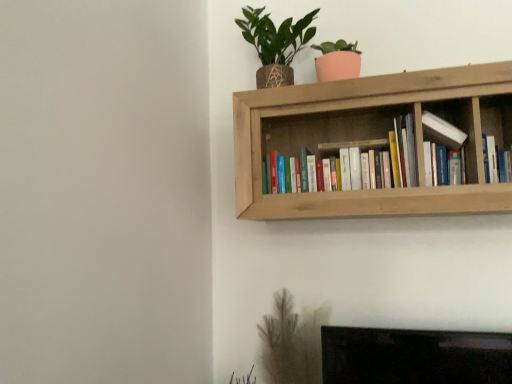
Describe the element at coordinates (496, 161) in the screenshot. I see `hardcover book at upper right, which is counted as the 1th book, starting from the right` at that location.

What is the approximate width of hardcover books at center, arranged as the second book when viewed from the right?

6.81 inches.

What do you see at coordinates (345, 138) in the screenshot? I see `hardcover books at center, the 1th book viewed from the left` at bounding box center [345, 138].

Identify the location of white glossy bookshelf at upper right. (452, 130).

Considering the positions of point (271, 83) and point (348, 176), is point (271, 83) closer or farther from the camera than point (348, 176)?

Point (271, 83) is closer to the camera than point (348, 176).

Can you confirm if green leafy plant in woven pot at upper right is bigger than hardcover books at center, arranged as the second book when viewed from the right?

Correct, green leafy plant in woven pot at upper right is larger in size than hardcover books at center, arranged as the second book when viewed from the right.

Is green leafy plant in woven pot at upper right positioned with its back to hardcover books at center, arranged as the second book when viewed from the right?

No, green leafy plant in woven pot at upper right is not facing the opposite direction of hardcover books at center, arranged as the second book when viewed from the right.

Find the location of a particular element. This screenshot has width=512, height=384. book that is the 1st one when counting downward from the natural wood bookshelf at upper center (from the image's perspective) is located at coordinates (345, 138).

From the image's perspective, between hardcover books at center, the 1th book viewed from the left, and natural wood bookshelf at upper center, who is located below?

hardcover books at center, the 1th book viewed from the left.

Is hardcover books at center, arranged as the second book when viewed from the right, at the left side of natural wood bookshelf at upper center?

Indeed, hardcover books at center, arranged as the second book when viewed from the right, is positioned on the left side of natural wood bookshelf at upper center.

Which of these two, hardcover book at upper right, positioned as the 2th book in left-to-right order, or white glossy bookshelf at upper right, stands taller?

white glossy bookshelf at upper right is taller.

Would you say white glossy bookshelf at upper right is part of hardcover book at upper right, which is counted as the 1th book, starting from the right,'s contents?

No.

Could you tell me if hardcover book at upper right, which is counted as the 1th book, starting from the right, is facing white glossy bookshelf at upper right?

No, hardcover book at upper right, which is counted as the 1th book, starting from the right, is not facing towards white glossy bookshelf at upper right.

Looking at this image, is the surface of hardcover book at upper right, positioned as the 2th book in left-to-right order, in direct contact with white glossy bookshelf at upper right?

hardcover book at upper right, positioned as the 2th book in left-to-right order, and white glossy bookshelf at upper right are clearly separated.

Is hardcover books at center, the 1th book viewed from the left, bigger than white glossy bookshelf at upper right?

Indeed, hardcover books at center, the 1th book viewed from the left, has a larger size compared to white glossy bookshelf at upper right.

Is hardcover books at center, the 1th book viewed from the left, turned away from white glossy bookshelf at upper right?

hardcover books at center, the 1th book viewed from the left, does not have its back to white glossy bookshelf at upper right.

From a real-world perspective, is hardcover books at center, arranged as the second book when viewed from the right, beneath white glossy bookshelf at upper right?

Yes, from a real-world perspective, hardcover books at center, arranged as the second book when viewed from the right, is below white glossy bookshelf at upper right.

Are hardcover books at center, arranged as the second book when viewed from the right, and white glossy bookshelf at upper right making contact?

hardcover books at center, arranged as the second book when viewed from the right, and white glossy bookshelf at upper right are clearly separated.

Does white glossy bookshelf at upper right touch hardcover books at center, the 1th book viewed from the left?

No, white glossy bookshelf at upper right is not making contact with hardcover books at center, the 1th book viewed from the left.

Could you tell me if white glossy bookshelf at upper right is facing hardcover books at center, arranged as the second book when viewed from the right?

No, white glossy bookshelf at upper right is not aimed at hardcover books at center, arranged as the second book when viewed from the right.

Locate an element on the screen. The width and height of the screenshot is (512, 384). cabinet above the hardcover books at center, arranged as the second book when viewed from the right (from a real-world perspective) is located at coordinates (452, 130).

Considering the relative sizes of white glossy bookshelf at upper right and hardcover books at center, arranged as the second book when viewed from the right, in the image provided, is white glossy bookshelf at upper right wider than hardcover books at center, arranged as the second book when viewed from the right,?

No.

Is hardcover books at center, the 1th book viewed from the left, positioned with its back to hardcover book at upper right, positioned as the 2th book in left-to-right order?

hardcover books at center, the 1th book viewed from the left, is not turned away from hardcover book at upper right, positioned as the 2th book in left-to-right order.

How many degrees apart are the facing directions of hardcover books at center, arranged as the second book when viewed from the right, and hardcover book at upper right, which is counted as the 1th book, starting from the right?

0.00383 degrees.

Is hardcover books at center, the 1th book viewed from the left, directly adjacent to hardcover book at upper right, positioned as the 2th book in left-to-right order?

No, hardcover books at center, the 1th book viewed from the left, is not in contact with hardcover book at upper right, positioned as the 2th book in left-to-right order.

In the scene shown: Looking at the image, does hardcover books at center, arranged as the second book when viewed from the right, seem bigger or smaller compared to hardcover book at upper right, which is counted as the 1th book, starting from the right?

Considering their sizes, hardcover books at center, arranged as the second book when viewed from the right, takes up more space than hardcover book at upper right, which is counted as the 1th book, starting from the right.

Between green leafy plant in woven pot at upper right and white glossy bookshelf at upper right, which one has more height?

With more height is green leafy plant in woven pot at upper right.

Which is closer to the camera, [238,22] or [433,117]?

The point [433,117] is closer.

Can white glossy bookshelf at upper right be found inside green leafy plant in woven pot at upper right?

Actually, white glossy bookshelf at upper right is outside green leafy plant in woven pot at upper right.

Is green leafy plant in woven pot at upper right further to camera compared to white glossy bookshelf at upper right?

Yes, the depth of green leafy plant in woven pot at upper right is greater than that of white glossy bookshelf at upper right.

At what (x,y) coordinates should I click in order to perform the action: click on houseplant behind the hardcover books at center, the 1th book viewed from the left. Please return your answer as a coordinate pair (x, y). Looking at the image, I should click on (275, 44).

Locate an element on the screen. This screenshot has height=384, width=512. shelf above the hardcover books at center, arranged as the second book when viewed from the right (from the image's perspective) is located at coordinates (372, 138).

From the picture: Estimate the real-world distances between objects in this image. Which object is closer to hardcover book at upper right, which is counted as the 1th book, starting from the right, white glossy bookshelf at upper right or natural wood bookshelf at upper center?

white glossy bookshelf at upper right.

When comparing their distances from natural wood bookshelf at upper center, does green leafy plant in woven pot at upper right or white glossy bookshelf at upper right seem further?

green leafy plant in woven pot at upper right is positioned further to the anchor natural wood bookshelf at upper center.

Which object lies nearer to the anchor point green leafy plant in woven pot at upper right, white glossy bookshelf at upper right or hardcover book at upper right, which is counted as the 1th book, starting from the right?

The object closer to green leafy plant in woven pot at upper right is white glossy bookshelf at upper right.

Estimate the real-world distances between objects in this image. Which object is further from natural wood bookshelf at upper center, white glossy bookshelf at upper right or green leafy plant in woven pot at upper right?

The object further to natural wood bookshelf at upper center is green leafy plant in woven pot at upper right.

From the image, which object appears to be nearer to hardcover books at center, the 1th book viewed from the left, hardcover book at upper right, positioned as the 2th book in left-to-right order, or white glossy bookshelf at upper right?

Based on the image, white glossy bookshelf at upper right appears to be nearer to hardcover books at center, the 1th book viewed from the left.

Which object lies further to the anchor point white glossy bookshelf at upper right, natural wood bookshelf at upper center or hardcover books at center, arranged as the second book when viewed from the right?

natural wood bookshelf at upper center.

From the image, which object appears to be nearer to hardcover books at center, arranged as the second book when viewed from the right, green leafy plant in woven pot at upper right or natural wood bookshelf at upper center?

Based on the image, natural wood bookshelf at upper center appears to be nearer to hardcover books at center, arranged as the second book when viewed from the right.

Considering their positions, is hardcover book at upper right, which is counted as the 1th book, starting from the right, positioned further to white glossy bookshelf at upper right than natural wood bookshelf at upper center?

Among the two, natural wood bookshelf at upper center is located further to white glossy bookshelf at upper right.

Locate an element on the screen. The height and width of the screenshot is (384, 512). book between green leafy plant in woven pot at upper right and hardcover book at upper right, positioned as the 2th book in left-to-right order is located at coordinates (345, 138).

You are a GUI agent. You are given a task and a screenshot of the screen. Output one action in this format:
    pyautogui.click(x=<x>, y=<y>)
    Task: Click on the shelf between green leafy plant in woven pot at upper right and hardcover books at center, arranged as the second book when viewed from the right, in the up-down direction
    The image size is (512, 384).
    Given the screenshot: What is the action you would take?
    pyautogui.click(x=372, y=138)

Locate an element on the screen. Image resolution: width=512 pixels, height=384 pixels. cabinet between hardcover books at center, arranged as the second book when viewed from the right, and hardcover book at upper right, which is counted as the 1th book, starting from the right is located at coordinates pyautogui.click(x=452, y=130).

Identify the location of shelf between hardcover books at center, arranged as the second book when viewed from the right, and hardcover book at upper right, positioned as the 2th book in left-to-right order, in the horizontal direction. Image resolution: width=512 pixels, height=384 pixels. (372, 138).